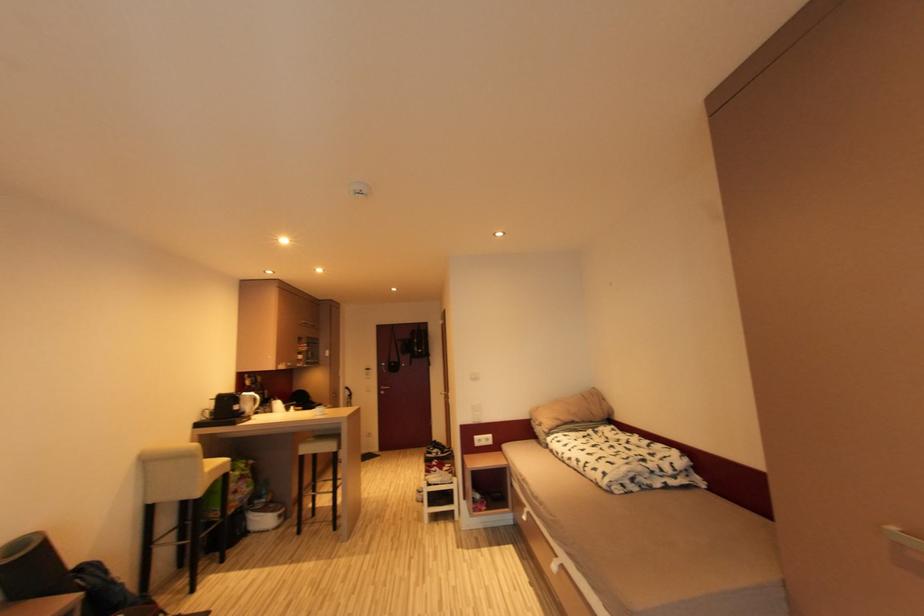
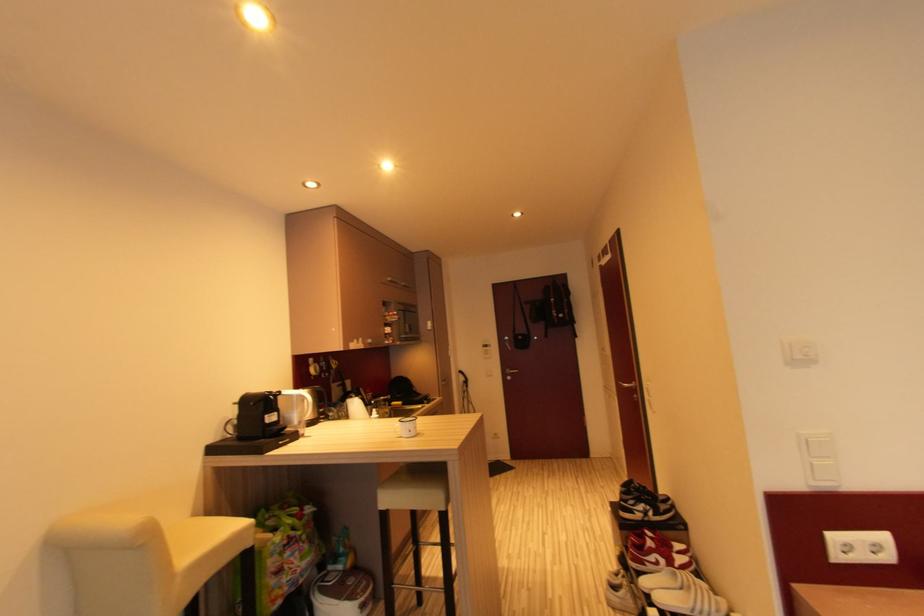
Question: In a continuous first-person perspective shot, in which direction is the camera moving?

Choices:
 (A) Left
 (B) Right
 (C) Forward
 (D) Backward

Answer: (C)